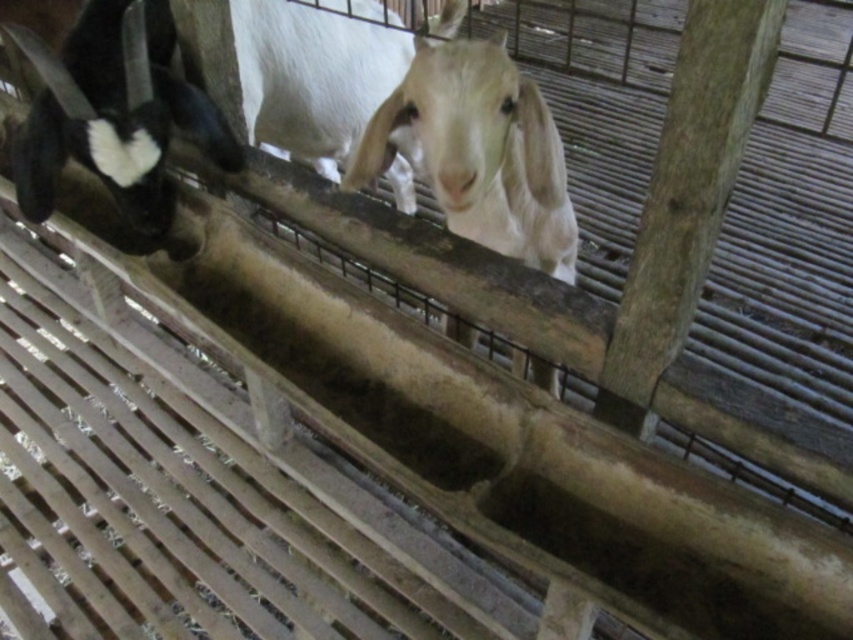
Is white matte goat at upper center positioned behind white matte goat at center?

No, white matte goat at upper center is in front of white matte goat at center.

Which is above, white matte goat at upper center or white matte goat at center?

white matte goat at center is higher up.

Is point (131, 10) positioned after point (329, 84)?

No, it is in front of (329, 84).

This screenshot has height=640, width=853. What are the coordinates of `white matte goat at upper center` in the screenshot? It's located at (113, 113).

Describe the element at coordinates (480, 150) in the screenshot. I see `white woolen goat at center` at that location.

Is point (444, 112) positioned before point (167, 67)?

Yes, point (444, 112) is in front of point (167, 67).

Where is `white woolen goat at center`? The height and width of the screenshot is (640, 853). white woolen goat at center is located at coordinates (480, 150).

Is white woolen goat at center positioned at the back of white matte goat at center?

No.

Does white woolen goat at center appear under white matte goat at center?

Yes.

Which is in front, point (476, 134) or point (299, 132)?

Positioned in front is point (476, 134).

Find the location of a particular element. Image resolution: width=853 pixels, height=640 pixels. white woolen goat at center is located at coordinates (480, 150).